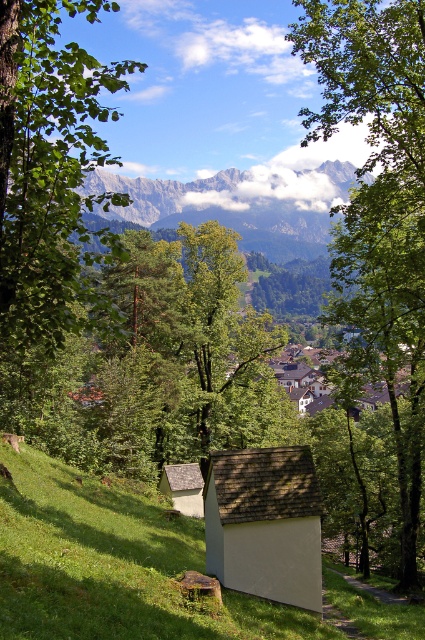
Is point (170, 465) more distant than point (204, 593)?

Yes, it is behind point (204, 593).

Which is in front, point (195, 467) or point (201, 582)?

Point (201, 582) is more forward.

Locate an element on the screen. The image size is (425, 640). white wood hut at lower center is located at coordinates (184, 486).

Consider the image. Can you confirm if green leafy tree at center is positioned above brown wooden picnic table at lower center?

Yes.

Does green leafy tree at center appear on the right side of brown wooden picnic table at lower center?

Yes, green leafy tree at center is to the right of brown wooden picnic table at lower center.

Does point (367, 113) come in front of point (220, 593)?

No, it is not.

What are the coordinates of `green leafy tree at center` in the screenshot? It's located at coord(379,209).

Does green leafy tree at left come in front of brown wooden picnic table at lower center?

Yes, green leafy tree at left is closer to the viewer.

Looking at this image, does green leafy tree at left have a lesser height compared to brown wooden picnic table at lower center?

In fact, green leafy tree at left may be taller than brown wooden picnic table at lower center.

Find the location of `green leafy tree at left`. green leafy tree at left is located at coordinates (51, 173).

Locate an element on the screen. The height and width of the screenshot is (640, 425). green leafy tree at left is located at coordinates (51, 173).